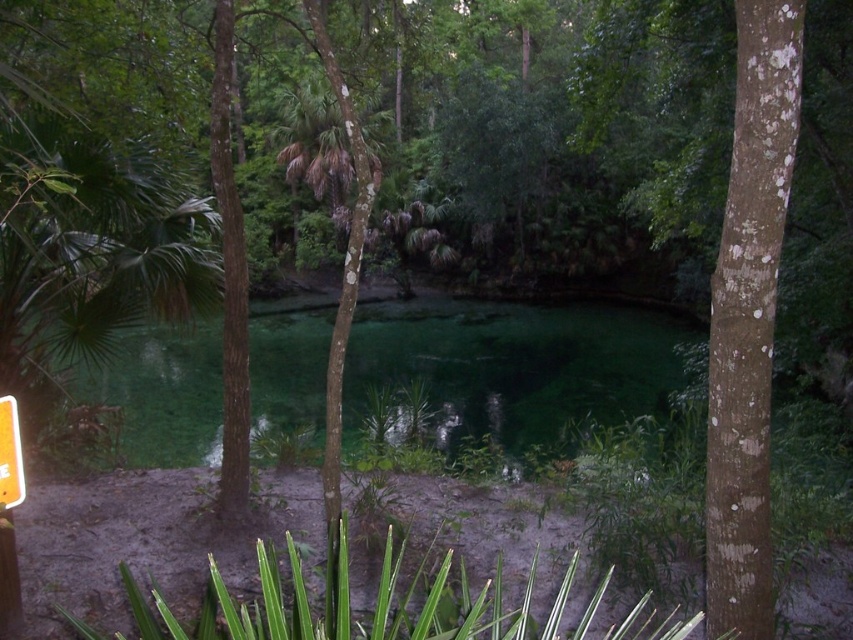
Question: Which of the following is the farthest from the observer?

Choices:
 (A) brown rough bark tree at right
 (B) orange plastic sign at lower left
 (C) green translucent water at center

Answer: (C)

Question: Is the position of brown rough bark tree at right less distant than that of orange plastic sign at lower left?

Choices:
 (A) no
 (B) yes

Answer: (B)

Question: Which object is positioned closest to the green translucent water at center?

Choices:
 (A) orange plastic sign at lower left
 (B) brown rough bark tree at right

Answer: (A)

Question: Which point is farther to the camera?

Choices:
 (A) orange plastic sign at lower left
 (B) brown rough bark tree at right
 (C) green translucent water at center

Answer: (C)

Question: Does brown rough bark tree at right come in front of orange plastic sign at lower left?

Choices:
 (A) no
 (B) yes

Answer: (B)

Question: Is green translucent water at center to the right of orange plastic sign at lower left from the viewer's perspective?

Choices:
 (A) no
 (B) yes

Answer: (B)